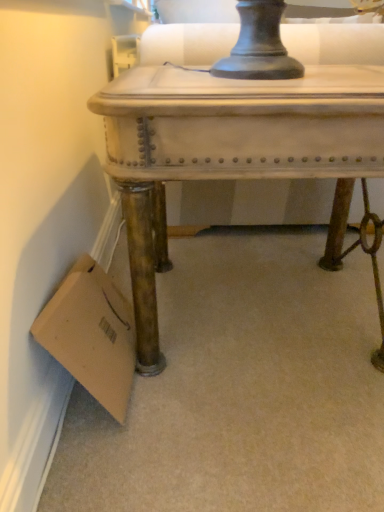
Identify the location of distressed white table at center. Image resolution: width=384 pixels, height=512 pixels. (238, 154).

Describe the element at coordinates (238, 154) in the screenshot. I see `distressed white table at center` at that location.

Describe the element at coordinates (92, 334) in the screenshot. This screenshot has width=384, height=512. I see `brown cardboard at lower left` at that location.

Find the location of a particular element. The height and width of the screenshot is (512, 384). brown cardboard at lower left is located at coordinates (92, 334).

Identify the location of distressed white table at center. (238, 154).

Considering the relative positions of distressed white table at center and brown cardboard at lower left in the image provided, is distressed white table at center to the left of brown cardboard at lower left from the viewer's perspective?

No, distressed white table at center is not to the left of brown cardboard at lower left.

Which object is closer to the camera, distressed white table at center or brown cardboard at lower left?

distressed white table at center.

Does point (354, 80) appear closer or farther from the camera than point (123, 306)?

Point (354, 80) appears to be closer to the viewer than point (123, 306).

From the image's perspective, is distressed white table at center over brown cardboard at lower left?

Correct, distressed white table at center appears higher than brown cardboard at lower left in the image.

From a real-world perspective, is distressed white table at center located beneath brown cardboard at lower left?

No, from a real-world perspective, distressed white table at center is not beneath brown cardboard at lower left.

In terms of width, does distressed white table at center look wider or thinner when compared to brown cardboard at lower left?

In the image, distressed white table at center appears to be wider than brown cardboard at lower left.

Which of these two, distressed white table at center or brown cardboard at lower left, stands taller?

distressed white table at center is taller.

Can you confirm if distressed white table at center is smaller than brown cardboard at lower left?

No, distressed white table at center is not smaller than brown cardboard at lower left.

Is distressed white table at center situated inside brown cardboard at lower left or outside?

distressed white table at center is located beyond the bounds of brown cardboard at lower left.

Are distressed white table at center and brown cardboard at lower left beside each other?

They are not placed beside each other.

Is brown cardboard at lower left at the back of distressed white table at center?

Yes, distressed white table at center is positioned with its back facing brown cardboard at lower left.

Looking at this image, can you tell me how much distressed white table at center and brown cardboard at lower left differ in facing direction?

distressed white table at center and brown cardboard at lower left are facing 1.37 degrees away from each other.

You are a GUI agent. You are given a task and a screenshot of the screen. Output one action in this format:
    pyautogui.click(x=<x>, y=<y>)
    Task: Click on the cardboard box behind the distressed white table at center
    
    Given the screenshot: What is the action you would take?
    pyautogui.click(x=92, y=334)

Is brown cardboard at lower left to the left or to the right of distressed white table at center in the image?

Based on their positions, brown cardboard at lower left is located to the left of distressed white table at center.

In the image, is brown cardboard at lower left positioned in front of or behind distressed white table at center?

In the image, brown cardboard at lower left appears behind distressed white table at center.

Considering the points (120, 341) and (224, 108), which point is in front, point (120, 341) or point (224, 108)?

Positioned in front is point (224, 108).

From the image's perspective, between brown cardboard at lower left and distressed white table at center, who is located below?

brown cardboard at lower left, from the image's perspective.

From a real-world perspective, is brown cardboard at lower left positioned above or below distressed white table at center?

From a real-world perspective, brown cardboard at lower left is physically below distressed white table at center.

From the picture: Considering the relative sizes of brown cardboard at lower left and distressed white table at center in the image provided, is brown cardboard at lower left thinner than distressed white table at center?

Yes, brown cardboard at lower left is thinner than distressed white table at center.

Which of these two, brown cardboard at lower left or distressed white table at center, stands shorter?

Standing shorter between the two is brown cardboard at lower left.

Is brown cardboard at lower left smaller than distressed white table at center?

Indeed, brown cardboard at lower left has a smaller size compared to distressed white table at center.

Consider the image. Is brown cardboard at lower left not within distressed white table at center?

Yes, brown cardboard at lower left is not within distressed white table at center.

Is brown cardboard at lower left placed right next to distressed white table at center?

No, brown cardboard at lower left is not with distressed white table at center.

Is brown cardboard at lower left turned away from distressed white table at center?

No, brown cardboard at lower left is not facing the opposite direction of distressed white table at center.

You are a GUI agent. You are given a task and a screenshot of the screen. Output one action in this format:
    pyautogui.click(x=<x>, y=<y>)
    Task: Click on the cardboard box located underneath the distressed white table at center (from a real-world perspective)
    The image size is (384, 512).
    Given the screenshot: What is the action you would take?
    pyautogui.click(x=92, y=334)

This screenshot has width=384, height=512. In order to click on cardboard box below the distressed white table at center (from a real-world perspective) in this screenshot , I will do `click(92, 334)`.

The height and width of the screenshot is (512, 384). Identify the location of table that is in front of the brown cardboard at lower left. (238, 154).